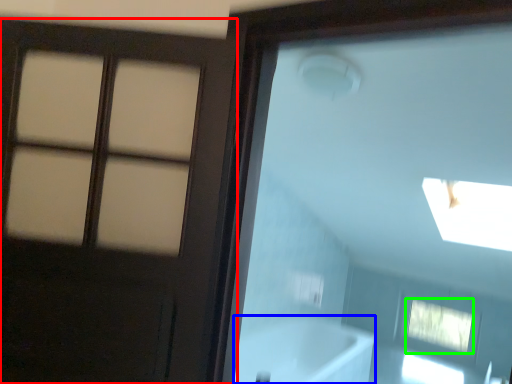
Question: Which object is the farthest from door (highlighted by a red box)? Choose among these: bath (highlighted by a blue box) or window (highlighted by a green box).

Choices:
 (A) bath
 (B) window

Answer: (B)